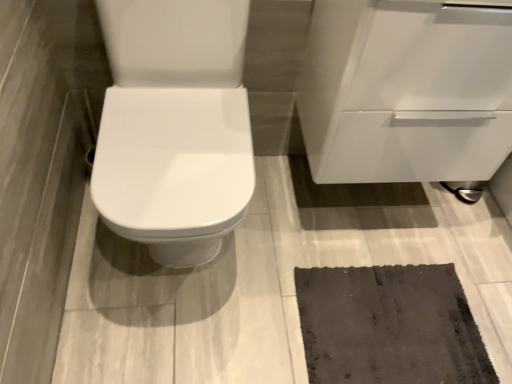
What do you see at coordinates (389, 326) in the screenshot?
I see `dark gray textured mat at lower right` at bounding box center [389, 326].

This screenshot has width=512, height=384. I want to click on dark gray textured mat at lower right, so click(x=389, y=326).

Find the location of a particular element. white glossy cabinet at upper right is located at coordinates (406, 91).

Describe the element at coordinates (406, 91) in the screenshot. This screenshot has width=512, height=384. I see `white glossy cabinet at upper right` at that location.

What is the approximate width of white glossy cabinet at upper right?

14.76 inches.

Identify the location of dark gray textured mat at lower right. This screenshot has width=512, height=384. (389, 326).

Visually, is dark gray textured mat at lower right positioned to the left or to the right of white glossy cabinet at upper right?

In the image, dark gray textured mat at lower right appears on the left side of white glossy cabinet at upper right.

Based on the photo, is dark gray textured mat at lower right behind white glossy cabinet at upper right?

Yes, dark gray textured mat at lower right is behind white glossy cabinet at upper right.

Between point (463, 361) and point (488, 37), which one is positioned in front?

The point (488, 37) is in front.

From the image's perspective, which is below, dark gray textured mat at lower right or white glossy cabinet at upper right?

dark gray textured mat at lower right is shown below in the image.

From a real-world perspective, which is physically above, dark gray textured mat at lower right or white glossy cabinet at upper right?

From a 3D spatial view, white glossy cabinet at upper right is above.

Between dark gray textured mat at lower right and white glossy cabinet at upper right, which one has smaller width?

dark gray textured mat at lower right is thinner.

Considering the sizes of objects dark gray textured mat at lower right and white glossy cabinet at upper right in the image provided, who is shorter, dark gray textured mat at lower right or white glossy cabinet at upper right?

With less height is dark gray textured mat at lower right.

Is dark gray textured mat at lower right smaller than white glossy cabinet at upper right?

Yes, dark gray textured mat at lower right is smaller than white glossy cabinet at upper right.

Consider the image. Would you say white glossy cabinet at upper right is part of dark gray textured mat at lower right's contents?

No, white glossy cabinet at upper right is located outside of dark gray textured mat at lower right.

Is there a large distance between dark gray textured mat at lower right and white glossy cabinet at upper right?

dark gray textured mat at lower right is near white glossy cabinet at upper right, not far away.

Is dark gray textured mat at lower right facing away from white glossy cabinet at upper right?

No, dark gray textured mat at lower right's orientation is not away from white glossy cabinet at upper right.

The height and width of the screenshot is (384, 512). What are the coordinates of `cabinetry above the dark gray textured mat at lower right (from a real-world perspective)` in the screenshot? It's located at (406, 91).

Is white glossy cabinet at upper right at the left side of dark gray textured mat at lower right?

Incorrect, white glossy cabinet at upper right is not on the left side of dark gray textured mat at lower right.

Considering their positions, is white glossy cabinet at upper right located in front of or behind dark gray textured mat at lower right?

Visually, white glossy cabinet at upper right is located in front of dark gray textured mat at lower right.

Is point (496, 38) closer or farther from the camera than point (372, 382)?

Point (496, 38).

From the image's perspective, which one is positioned higher, white glossy cabinet at upper right or dark gray textured mat at lower right?

white glossy cabinet at upper right.

From a real-world perspective, is white glossy cabinet at upper right physically below dark gray textured mat at lower right?

No, from a real-world perspective, white glossy cabinet at upper right is not beneath dark gray textured mat at lower right.

Considering the sizes of white glossy cabinet at upper right and dark gray textured mat at lower right in the image, is white glossy cabinet at upper right wider or thinner than dark gray textured mat at lower right?

In the image, white glossy cabinet at upper right appears to be wider than dark gray textured mat at lower right.

Considering the sizes of objects white glossy cabinet at upper right and dark gray textured mat at lower right in the image provided, who is taller, white glossy cabinet at upper right or dark gray textured mat at lower right?

white glossy cabinet at upper right is taller.

Does white glossy cabinet at upper right have a smaller size compared to dark gray textured mat at lower right?

Result: No, white glossy cabinet at upper right is not smaller than dark gray textured mat at lower right.

Is white glossy cabinet at upper right not inside dark gray textured mat at lower right?

That's correct, white glossy cabinet at upper right is outside of dark gray textured mat at lower right.

Is white glossy cabinet at upper right placed right next to dark gray textured mat at lower right?

No.

Is white glossy cabinet at upper right turned away from dark gray textured mat at lower right?

No, white glossy cabinet at upper right is not facing away from dark gray textured mat at lower right.

From the picture: How different are the orientations of white glossy cabinet at upper right and dark gray textured mat at lower right in degrees?

The facing directions of white glossy cabinet at upper right and dark gray textured mat at lower right are 1.05 degrees apart.

Identify the location of cabinetry above the dark gray textured mat at lower right (from a real-world perspective). The image size is (512, 384). (406, 91).

The height and width of the screenshot is (384, 512). Identify the location of doormat that is under the white glossy cabinet at upper right (from a real-world perspective). (389, 326).

In order to click on cabinetry that is in front of the dark gray textured mat at lower right in this screenshot , I will do `click(406, 91)`.